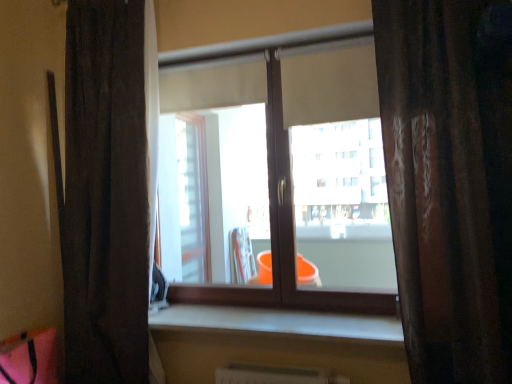
Question: In the image, is transparent glass window at center on the left side or the right side of smooth concrete window sill at center?

Choices:
 (A) left
 (B) right

Answer: (A)

Question: Is transparent glass window at center inside the boundaries of smooth concrete window sill at center, or outside?

Choices:
 (A) outside
 (B) inside

Answer: (A)

Question: Which of these objects is positioned closest to the smooth concrete window sill at center?

Choices:
 (A) transparent glass window at center
 (B) dark fabric curtain at left, placed as the 1th curtain when sorted from back to front
 (C) brown textured curtain at right, the first curtain from the front

Answer: (A)

Question: Based on their relative distances, which object is nearer to the brown textured curtain at right, the second curtain when ordered from left to right?

Choices:
 (A) smooth concrete window sill at center
 (B) dark fabric curtain at left, the 1th curtain viewed from the left
 (C) transparent glass window at center

Answer: (C)